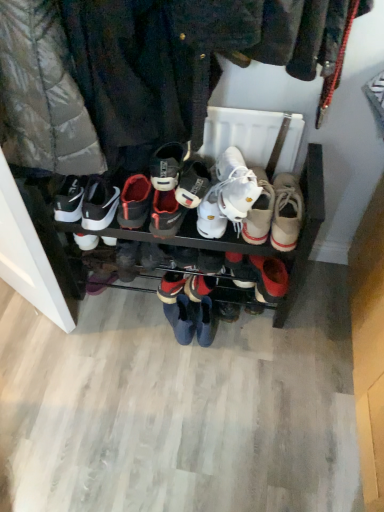
You are a GUI agent. You are given a task and a screenshot of the screen. Output one action in this format:
    pyautogui.click(x=<x>, y=<y>)
    Task: Click on the free space in front of blue suede boots at center, the fourth footwear viewed from the left
    
    Given the screenshot: What is the action you would take?
    pyautogui.click(x=177, y=360)